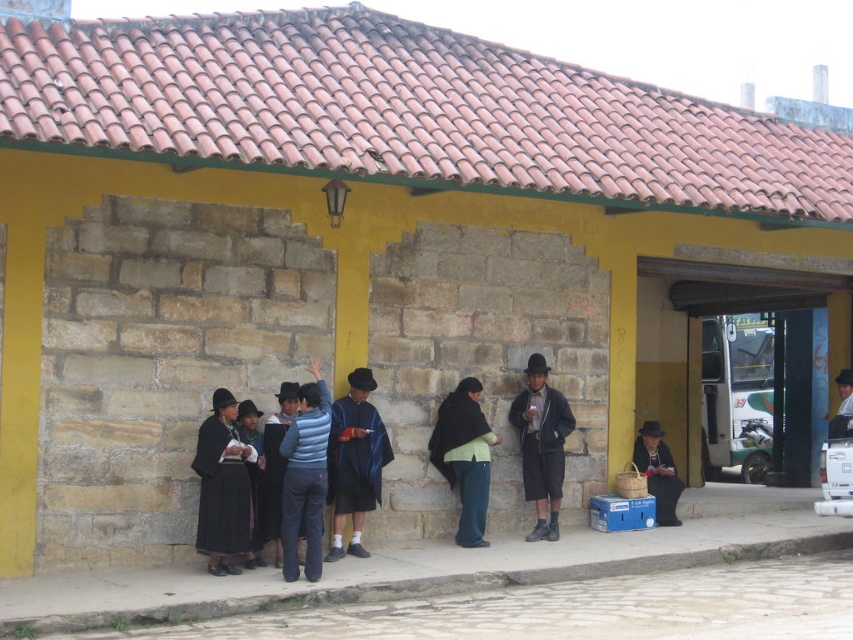
You are part of the group and want to greet the person wearing the blue striped sweater at center. Since you are standing near the black woolen dress at left, can you easily see them to wave?

The blue striped sweater at center is behind the black woolen dress at left, so you might not be able to see them clearly to wave.

You are organizing a photo shoot and need to arrange the black woolen dress at left and the blue striped sweater at center based on their widths. Which should be placed first if you want the wider item on the left side?

The black woolen dress at left should be placed first on the left side since it is wider than the blue striped sweater at center.

You are organizing a cultural event and need to arrange seating for two participants wearing the black woolen dress at left and the dark blue sweater at center. If the chairs are 40 cm wide, will the participants be able to sit comfortably?

The black woolen dress at left is wider than the dark blue sweater at center. Since the dress is wider, it might require more space. If the dress is wider than 40 cm, the participant might not fit comfortably. However, without exact measurements, we can only note that the dress is wider than the sweater.